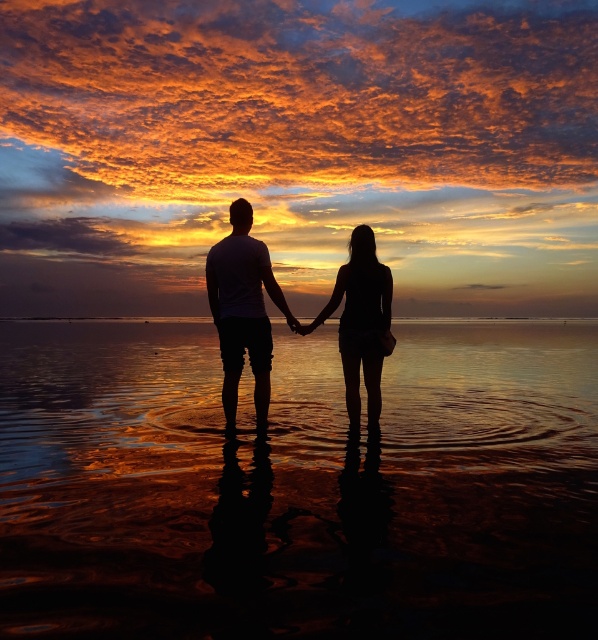
Which of these two, silhouette couple at center or black matte shorts at center, stands shorter?

Standing shorter between the two is black matte shorts at center.

Is point (228, 426) positioned before point (379, 298)?

That is False.

This screenshot has width=598, height=640. What do you see at coordinates (243, 308) in the screenshot? I see `silhouette couple at center` at bounding box center [243, 308].

Identify the location of silhouette couple at center. (243, 308).

Between point (568, 481) and point (353, 378), which one is positioned behind?

The point (353, 378) is behind.

Does reflective wet sand at center have a lesser width compared to black matte shorts at center?

No, reflective wet sand at center is not thinner than black matte shorts at center.

Where is `reflective wet sand at center`? The image size is (598, 640). reflective wet sand at center is located at coordinates (297, 484).

Image resolution: width=598 pixels, height=640 pixels. I want to click on reflective wet sand at center, so click(297, 484).

Which is more to the left, reflective wet sand at center or silhouette couple at center?

Positioned to the left is reflective wet sand at center.

Which of these two, reflective wet sand at center or silhouette couple at center, stands taller?

Standing taller between the two is silhouette couple at center.

Find the location of `reflective wet sand at center`. reflective wet sand at center is located at coordinates (297, 484).